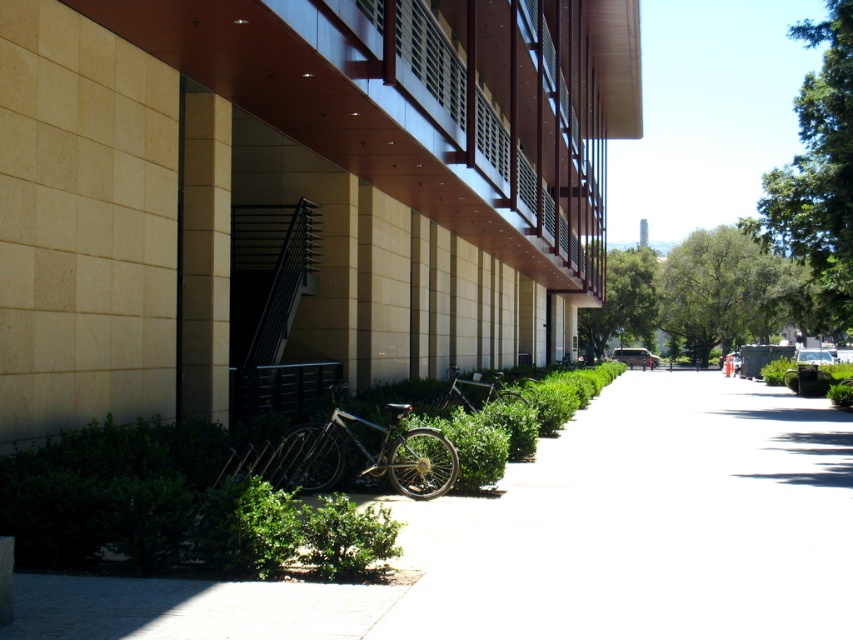
Can you confirm if white concrete pavement at lower center is bigger than shiny metallic bicycle at center?

Yes.

This screenshot has height=640, width=853. I want to click on white concrete pavement at lower center, so click(x=659, y=524).

Between point (811, 611) and point (456, 378), which one is positioned behind?

The point (456, 378) is behind.

In the scene shown: Who is positioned more to the right, white concrete pavement at lower center or silver metallic bicycle at center?

white concrete pavement at lower center

Does point (613, 518) lie in front of point (500, 376)?

Yes, point (613, 518) is in front of point (500, 376).

The height and width of the screenshot is (640, 853). In order to click on white concrete pavement at lower center in this screenshot , I will do `click(659, 524)`.

Looking at this image, does shiny metallic bicycle at center have a greater height compared to silver metallic bicycle at center?

Indeed, shiny metallic bicycle at center has a greater height compared to silver metallic bicycle at center.

Does point (445, 458) come closer to viewer compared to point (498, 381)?

That is True.

The height and width of the screenshot is (640, 853). Find the location of `shiny metallic bicycle at center`. shiny metallic bicycle at center is located at coordinates (370, 452).